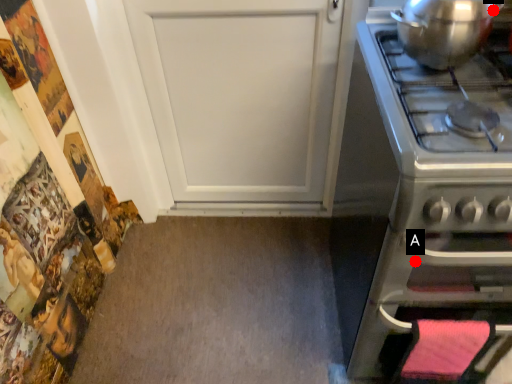
Question: Two points are circled on the image, labeled by A and B beside each circle. Which point is closer to the camera?

Choices:
 (A) A is closer
 (B) B is closer

Answer: (A)